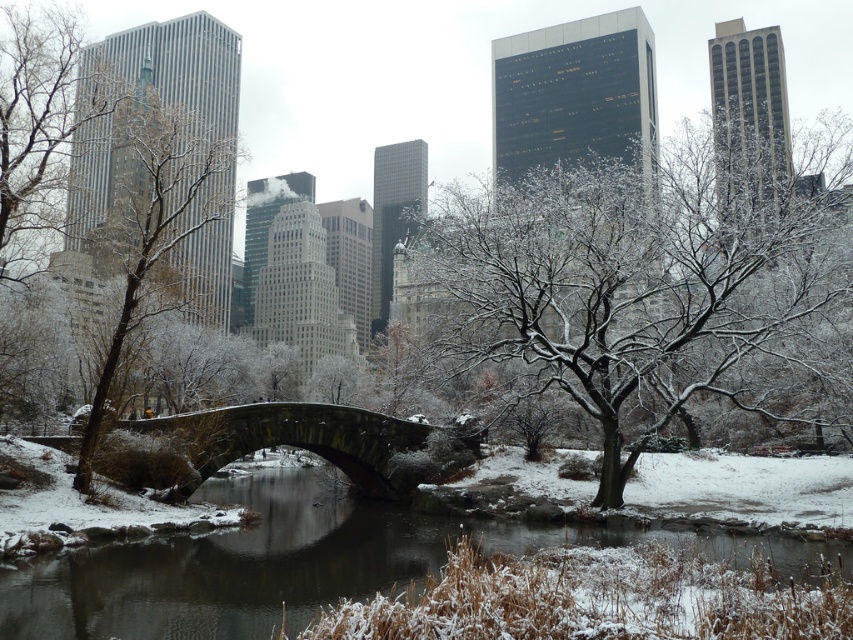
Question: Does snowy concrete bridge at center appear over dark gray stone bridge at center?

Choices:
 (A) no
 (B) yes

Answer: (A)

Question: Is snowy concrete bridge at center bigger than snow-covered bark tree at left?

Choices:
 (A) yes
 (B) no

Answer: (B)

Question: Estimate the real-world distances between objects in this image. Which object is closer to the snowy concrete bridge at center?

Choices:
 (A) snow-covered branches at center
 (B) snow-covered bark tree at left

Answer: (A)

Question: Which point appears farthest from the camera in this image?

Choices:
 (A) (543, 170)
 (B) (183, 604)
 (C) (242, 432)
 (D) (154, 100)

Answer: (A)

Question: Which object appears farthest from the camera in this image?

Choices:
 (A) snow-covered branches at center
 (B) snowy concrete bridge at center

Answer: (A)

Question: Is snow-covered branches at center below snow-covered bark tree at left?

Choices:
 (A) yes
 (B) no

Answer: (B)